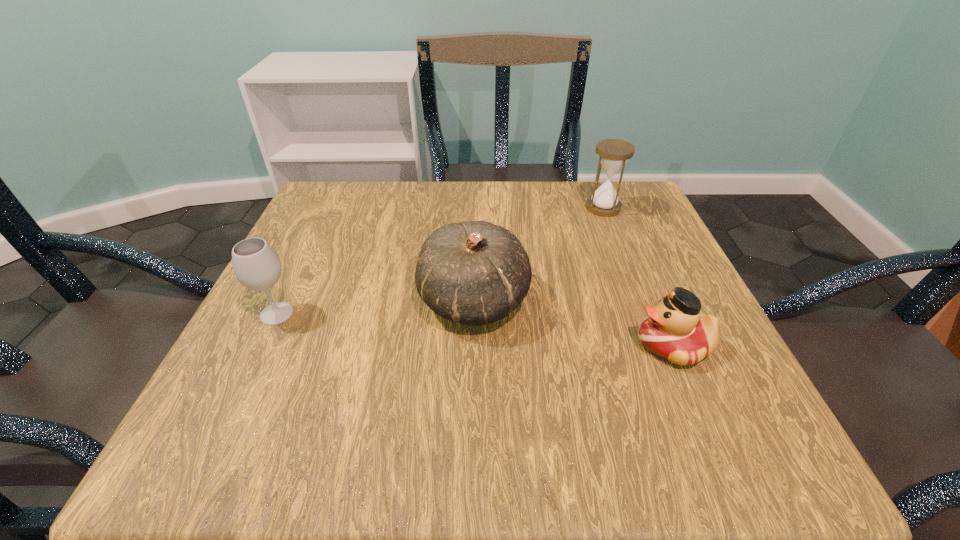
I want to click on object present at the far edge, so click(613, 154).

At what (x,y) coordinates should I click in order to perform the action: click on object that is positioned at the left edge. Please return your answer as a coordinate pair (x, y). The image size is (960, 540). Looking at the image, I should click on (256, 265).

Find the location of a particular element. hourglass that is positioned at the right edge is located at coordinates (613, 154).

Locate an element on the screen. The image size is (960, 540). duck that is at the right edge is located at coordinates (674, 330).

The image size is (960, 540). Find the location of `object at the far right corner`. object at the far right corner is located at coordinates (613, 154).

This screenshot has height=540, width=960. I want to click on vacant space at the far edge of the desktop, so click(x=378, y=217).

The height and width of the screenshot is (540, 960). What are the coordinates of `free point at the left edge` in the screenshot? It's located at (355, 284).

Image resolution: width=960 pixels, height=540 pixels. In order to click on vacant space at the right edge of the desktop in this screenshot , I will do coord(612,263).

This screenshot has height=540, width=960. I want to click on vacant region at the far left corner, so click(328, 198).

I want to click on vacant space at the near left corner, so click(247, 414).